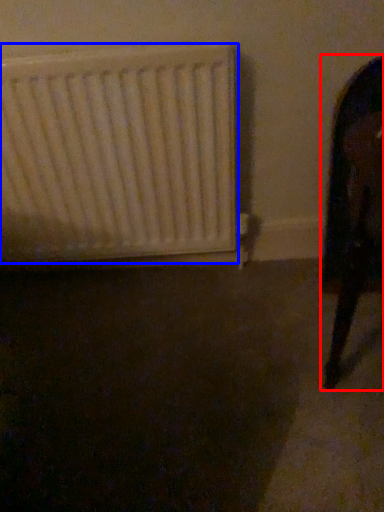
Question: Which of the following is the farthest to the observer, furniture (highlighted by a red box) or radiator (highlighted by a blue box)?

Choices:
 (A) furniture
 (B) radiator

Answer: (B)